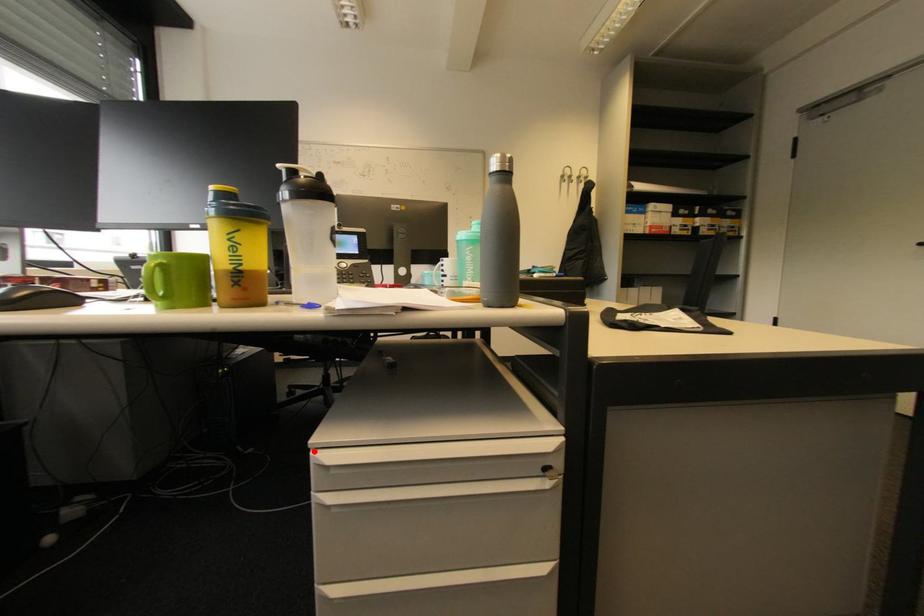
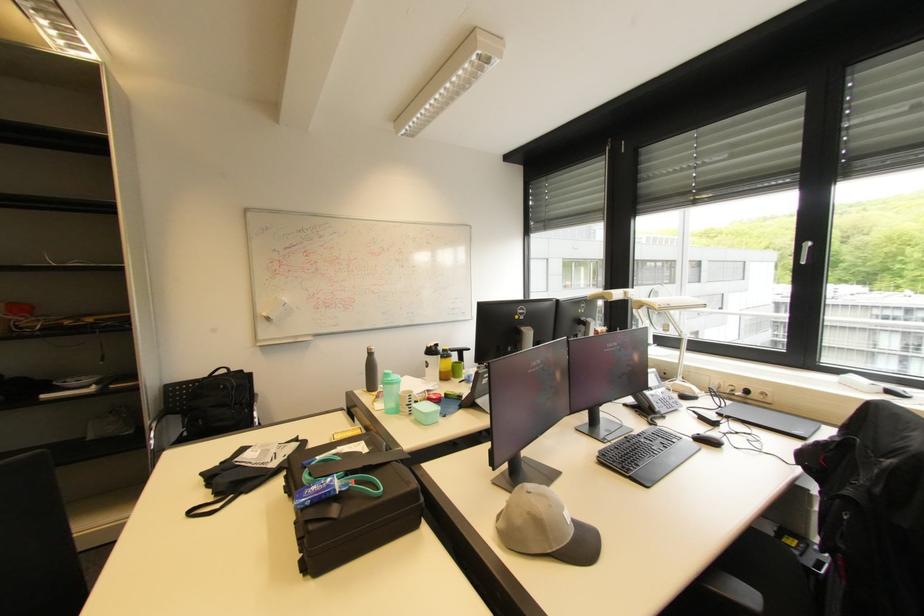
Question: I am providing you with two images of the same scene from different viewpoints. A red point is marked on the first image. At the location where the point appears in image 1, is it still visible in image 2?

Choices:
 (A) Yes
 (B) No

Answer: (B)